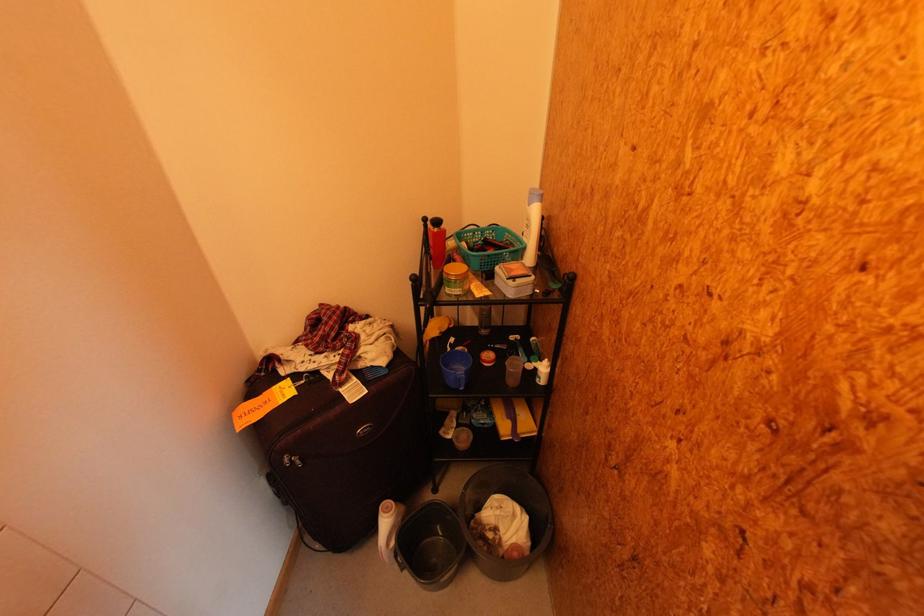
Find where to lift the orange lidded jar. Please return your answer as a coordinate pair (x, y).

(456, 278)